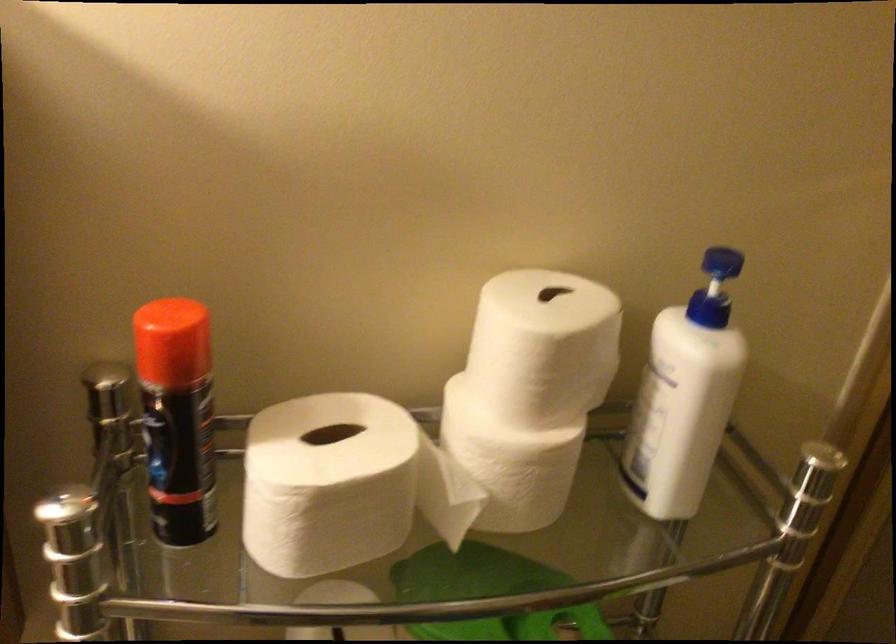
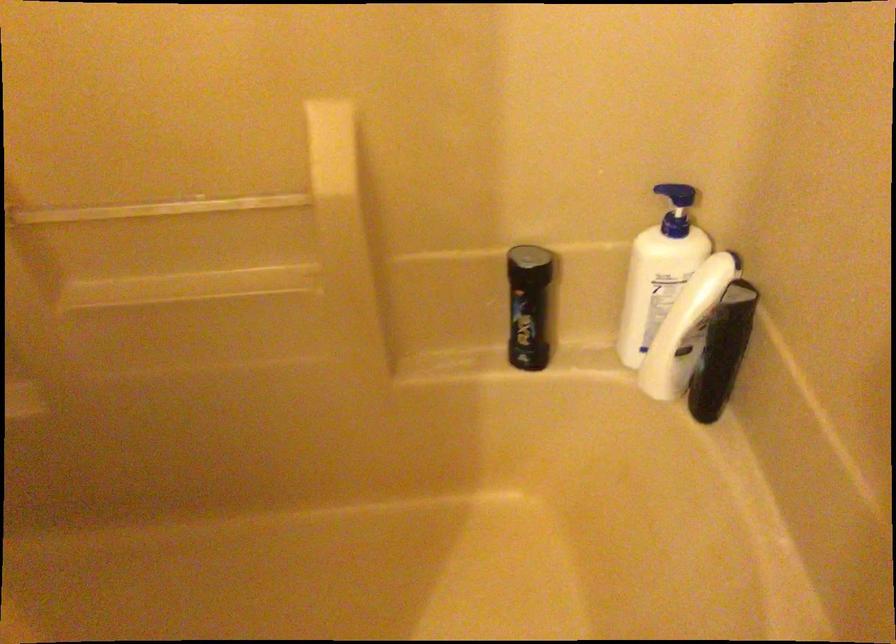
Based on the continuous images, in which direction is the camera rotating?

The camera rotated toward right-down.